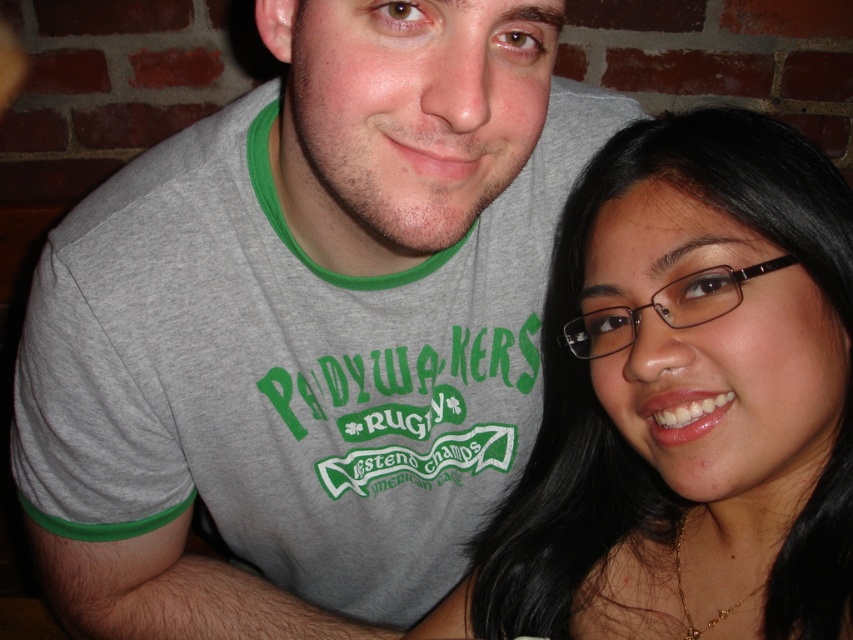
Question: Which object appears farthest from the camera in this image?

Choices:
 (A) gray cotton t-shirt at upper left
 (B) smooth skin face at center

Answer: (B)

Question: Which object is closer to the camera taking this photo?

Choices:
 (A) gray cotton t-shirt at upper left
 (B) smooth skin face at center

Answer: (A)

Question: Is gray cotton t-shirt at upper left positioned at the back of smooth skin face at center?

Choices:
 (A) yes
 (B) no

Answer: (B)

Question: In this image, where is gray cotton t-shirt at upper left located relative to smooth skin face at center?

Choices:
 (A) right
 (B) left

Answer: (B)

Question: Observing the image, what is the correct spatial positioning of gray cotton t-shirt at upper left in reference to smooth skin face at center?

Choices:
 (A) left
 (B) right

Answer: (A)